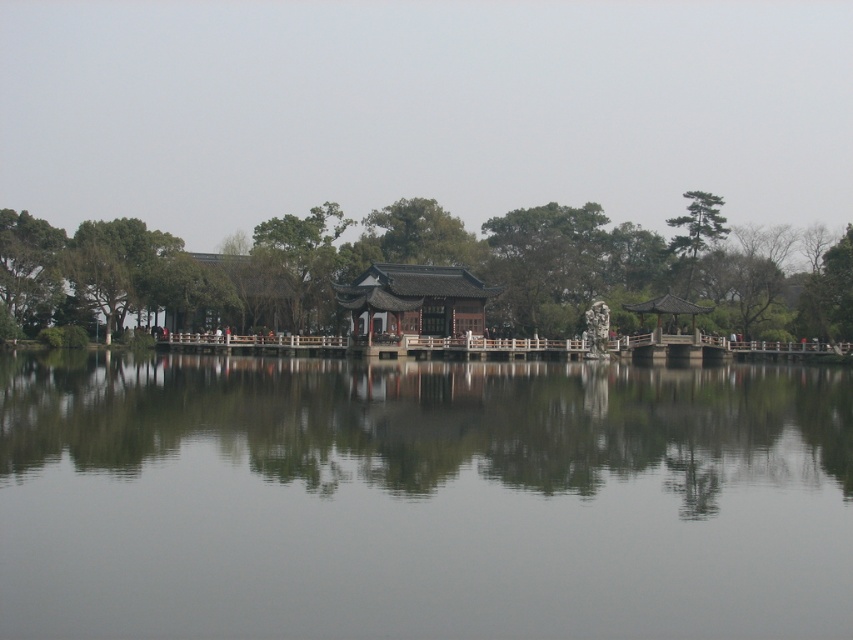
You are standing at the edge of the transparent water at center and want to walk to the green leafy tree at left. Which direction should you face to walk directly towards the tree?

You should face towards the left direction to walk directly towards the green leafy tree at left from the transparent water at center.

You are standing at the edge of the transparent water at center and want to walk towards the green leafy tree at left. Which direction should you face to move directly towards it?

Since the transparent water at center is to the left of green leafy tree at left, you should face to the right to walk directly towards the green leafy tree at left.

You are planning to plant a new tree between the green leafy tree at left and the green matte tree at center in the serene landscape. The new tree requires a minimum of 20 meters of space between it and the existing trees. Is there enough space for the new tree?

The green leafy tree at left and green matte tree at center are 23.20 meters apart, which is more than the required 20 meters. Therefore, there is enough space to plant the new tree between them while maintaining the required distance from both existing trees.